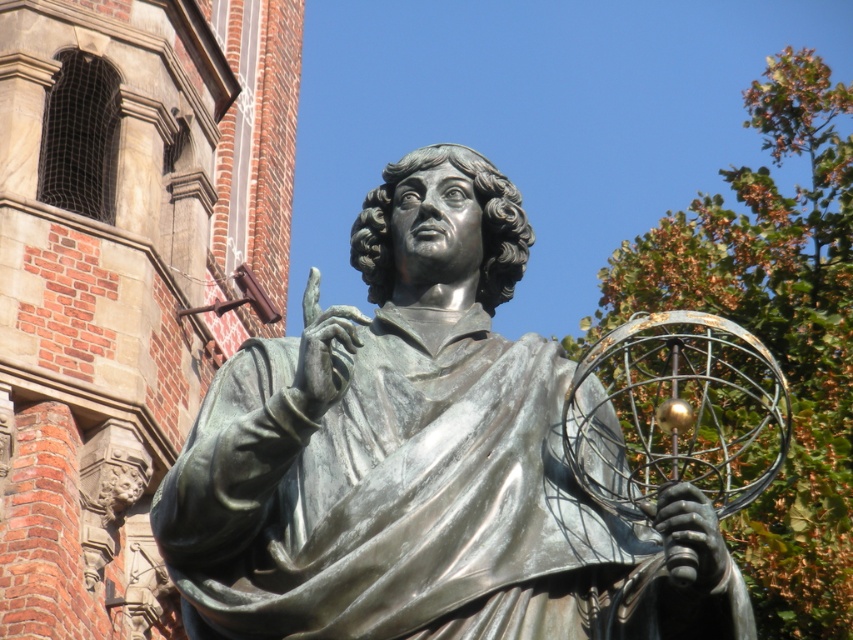
Question: Does bronze statue at center have a lesser width compared to brick wall at center?

Choices:
 (A) yes
 (B) no

Answer: (B)

Question: Is bronze statue at center below brick wall at center?

Choices:
 (A) no
 (B) yes

Answer: (B)

Question: Does bronze statue at center come behind brick wall at center?

Choices:
 (A) no
 (B) yes

Answer: (A)